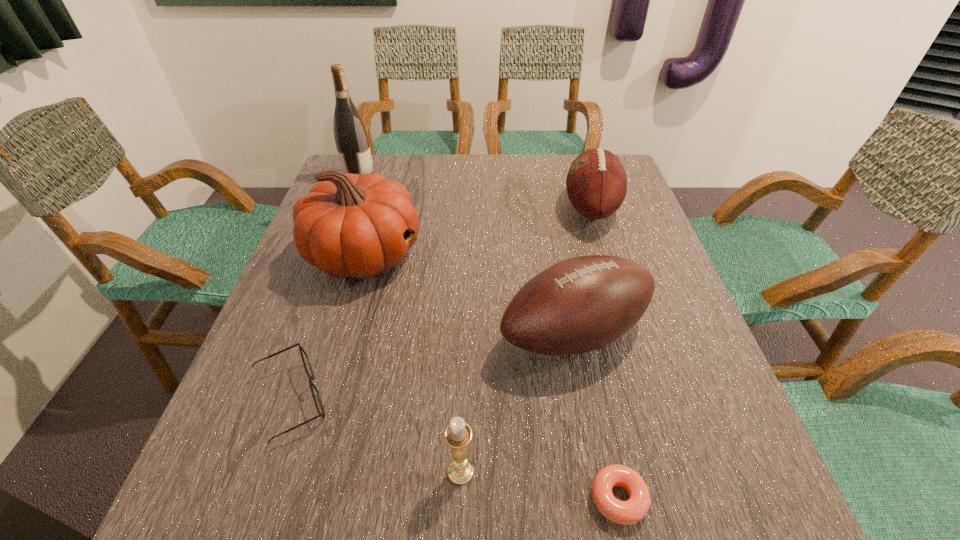
At what (x,y) coordinates should I click in order to perform the action: click on free space that satisfies the following two spatial constraints: 1. with the lenses facing outward on the candle holder; 2. on the right side of the second shortest object. Please return your answer as a coordinate pair (x, y). Looking at the image, I should click on (265, 471).

The height and width of the screenshot is (540, 960). I want to click on free spot that satisfies the following two spatial constraints: 1. with the lenses facing outward on the shortest object; 2. on the left side of the second shortest object, so click(256, 497).

Identify the location of vacant space that satisfies the following two spatial constraints: 1. on the back side of the candle holder; 2. with the lenses facing outward on the spectacles. (463, 400).

The width and height of the screenshot is (960, 540). I want to click on free spot that satisfies the following two spatial constraints: 1. on the back side of the farther football (American); 2. on the label of the tallest object, so click(x=582, y=177).

This screenshot has width=960, height=540. In order to click on free space that satisfies the following two spatial constraints: 1. on the back side of the doughnut; 2. with the lenses facing outward on the second shortest object in this screenshot , I will do `click(598, 400)`.

Locate an element on the screen. This screenshot has height=540, width=960. free space that satisfies the following two spatial constraints: 1. on the front side of the doughnut; 2. on the right side of the nearer football (American) is located at coordinates (606, 497).